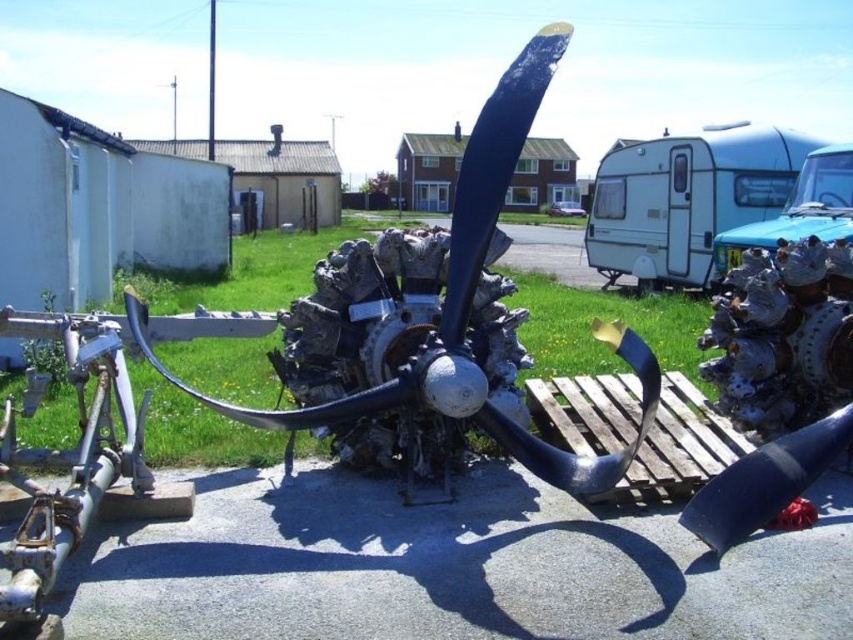
Question: Does light blue plastic trailer at upper right have a smaller size compared to blue metallic trailer at right?

Choices:
 (A) no
 (B) yes

Answer: (A)

Question: Among these points, which one is farthest from the camera?

Choices:
 (A) click(720, 150)
 (B) click(834, 212)

Answer: (A)

Question: Which point is farther to the camera?

Choices:
 (A) blue metallic propeller at center
 (B) blue metallic trailer at right
 (C) light blue plastic trailer at upper right

Answer: (C)

Question: Where is blue metallic propeller at center located in relation to blue metallic trailer at right in the image?

Choices:
 (A) below
 (B) above

Answer: (A)

Question: Among these points, which one is nearest to the camera?

Choices:
 (A) (618, 244)
 (B) (840, 161)
 (C) (570, 477)

Answer: (C)

Question: Does blue metallic propeller at center appear over blue metallic trailer at right?

Choices:
 (A) yes
 (B) no

Answer: (B)